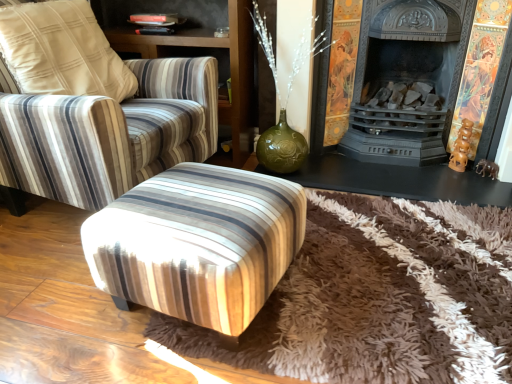
Identify the location of vacant space to the right of wooden stool at center. The image size is (512, 384). (362, 287).